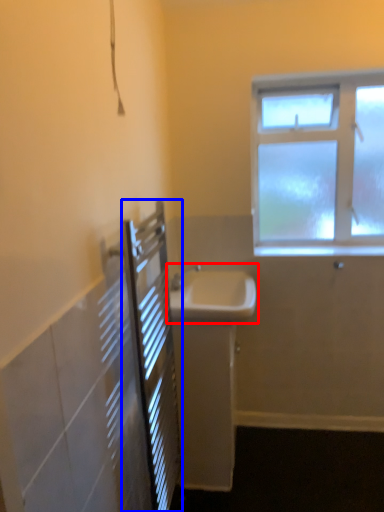
Question: Which of the following is the farthest to the observer, sink (highlighted by a red box) or screen door (highlighted by a blue box)?

Choices:
 (A) sink
 (B) screen door

Answer: (A)